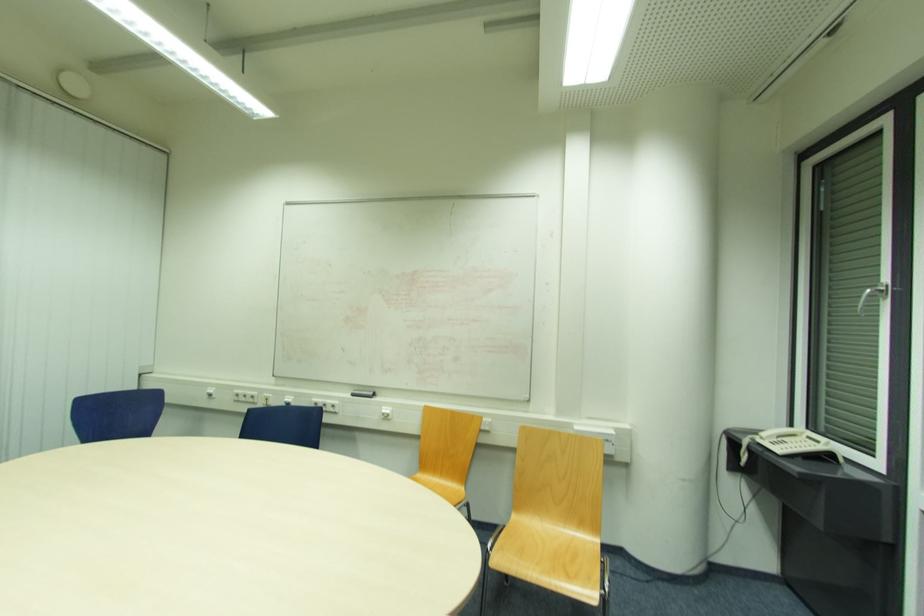
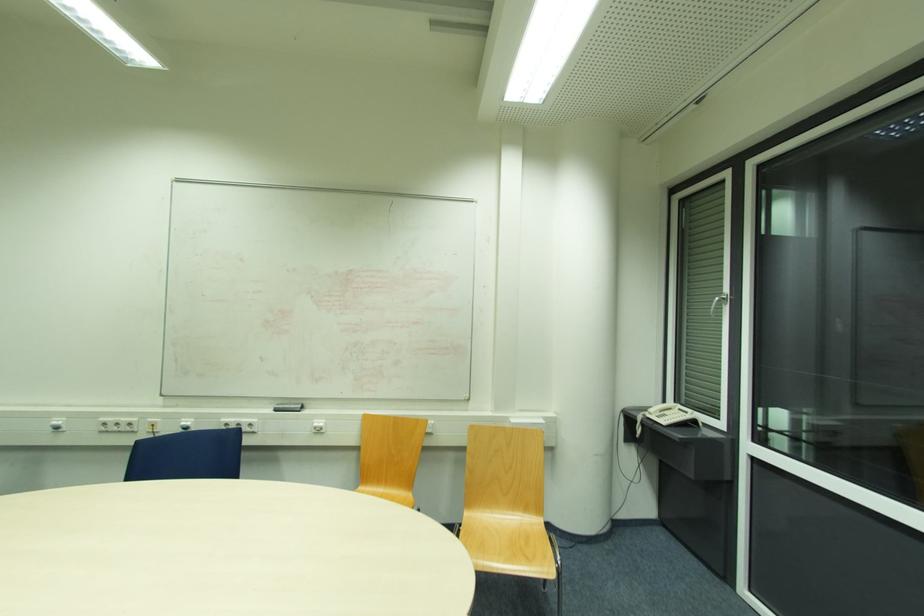
In the second image, find the point that corresponds to the point at 355,395 in the first image.

(276, 411)